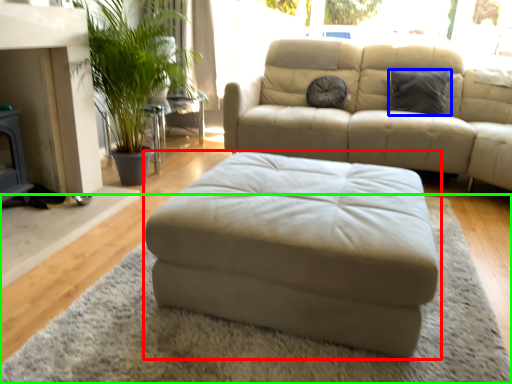
Question: Which is farther away from studio couch (highlighted by a red box)? pillow (highlighted by a blue box) or mat (highlighted by a green box)?

Choices:
 (A) pillow
 (B) mat

Answer: (A)